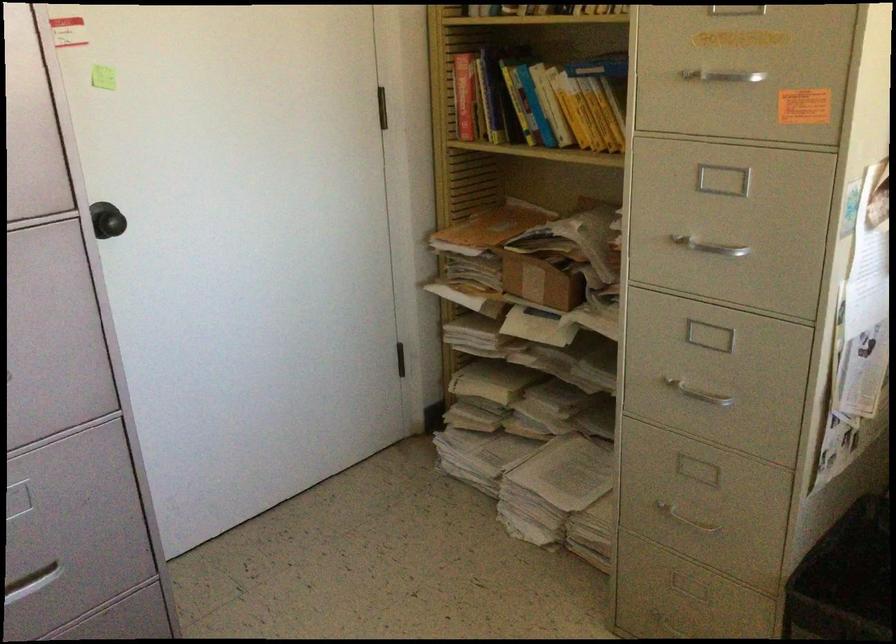
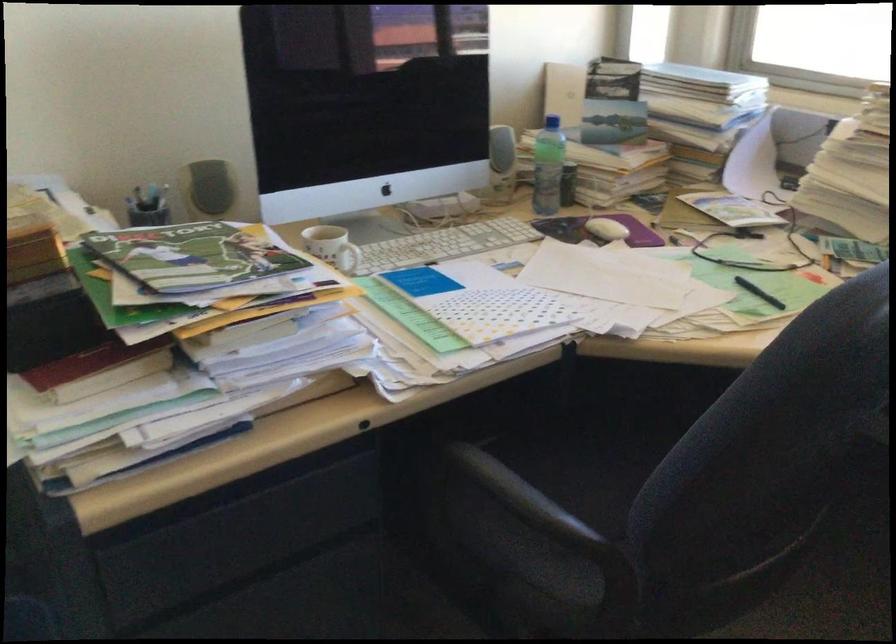
Based on the continuous images, in which direction is the camera rotating?

The camera rotated toward right-down.